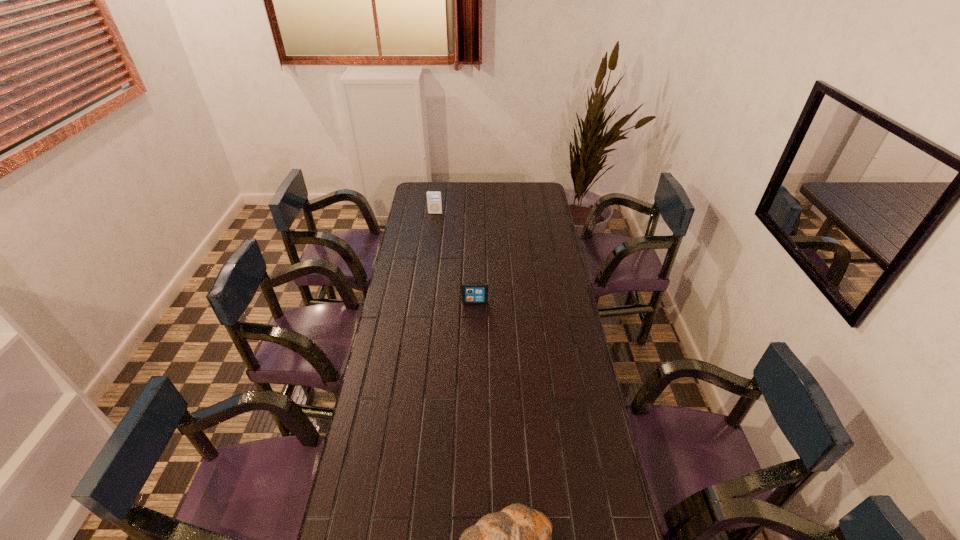
What are the coordinates of `the farthest object` in the screenshot? It's located at 434,201.

At what (x,y) coordinates should I click in order to perform the action: click on the taller iPod. Please return your answer as a coordinate pair (x, y). This screenshot has height=540, width=960. Looking at the image, I should click on (434, 201).

Image resolution: width=960 pixels, height=540 pixels. What are the coordinates of `the nearer iPod` in the screenshot? It's located at (472, 292).

I want to click on the right iPod, so click(x=472, y=292).

Find the location of a particular element. vacant space situated 0.290m on the front-facing side of the farther iPod is located at coordinates (431, 246).

The width and height of the screenshot is (960, 540). Find the location of `vacant space situated on the front screen of the nearer iPod`. vacant space situated on the front screen of the nearer iPod is located at coordinates (474, 368).

Where is `object positioned at the left edge`? object positioned at the left edge is located at coordinates (434, 201).

You are a GUI agent. You are given a task and a screenshot of the screen. Output one action in this format:
    pyautogui.click(x=<x>, y=<y>)
    Task: Click on the vacant space at the far edge
    The image size is (960, 540).
    Given the screenshot: What is the action you would take?
    pyautogui.click(x=480, y=203)

In the image, there is a desktop. At what (x,y) coordinates should I click in order to perform the action: click on blank space at the left edge. Please return your answer as a coordinate pair (x, y). The height and width of the screenshot is (540, 960). Looking at the image, I should click on (405, 276).

In the image, there is a desktop. Identify the location of vacant area at the right edge. This screenshot has width=960, height=540. (564, 476).